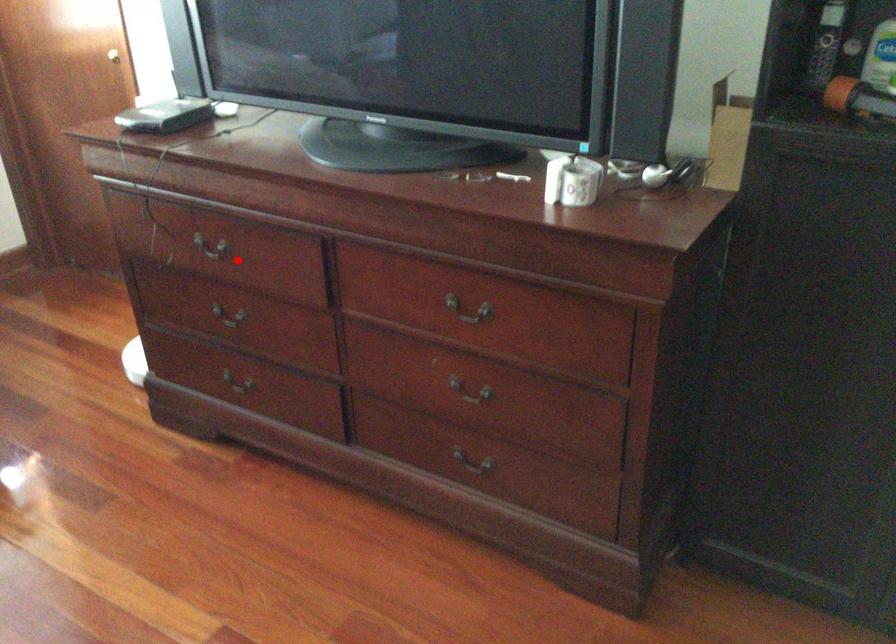
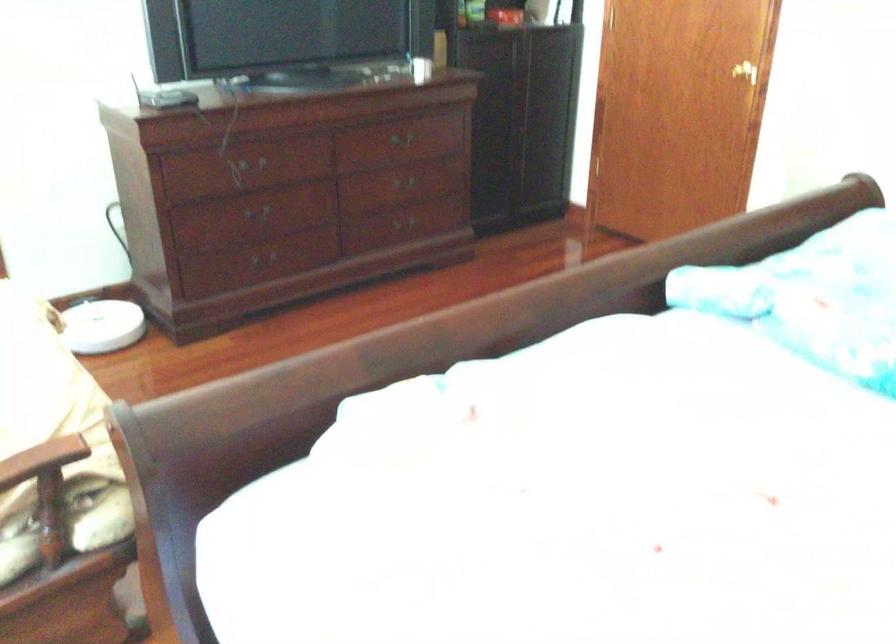
Locate, in the second image, the point that corresponds to the highlighted location in the first image.

(255, 164)